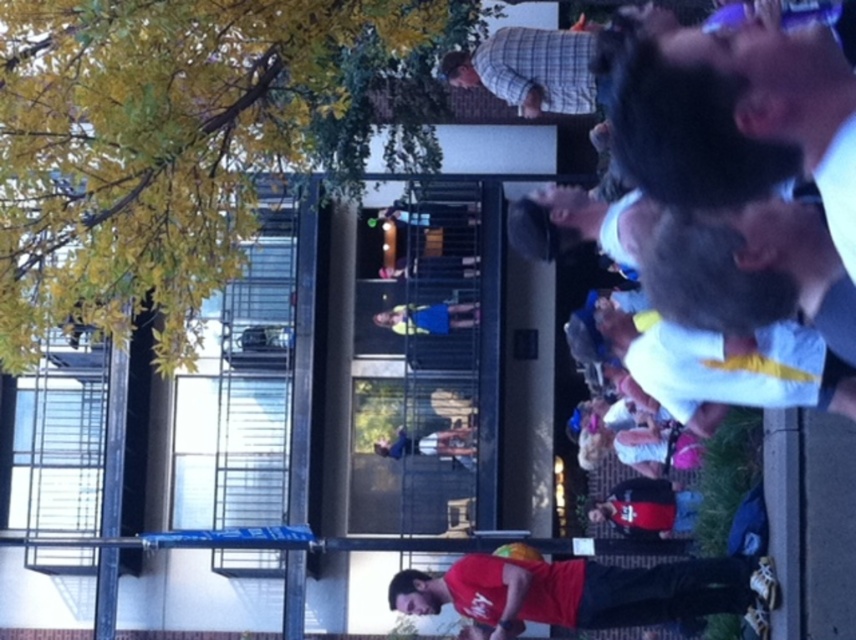
Question: Can you confirm if yellow leafy tree at upper left is positioned to the right of blue fabric dress at center?

Choices:
 (A) no
 (B) yes

Answer: (A)

Question: Does white matte shirt at upper right lie in front of blue fabric dress at center?

Choices:
 (A) no
 (B) yes

Answer: (B)

Question: Which of the following is the closest to the observer?

Choices:
 (A) white matte shirt at upper right
 (B) yellow leafy tree at upper left
 (C) blue fabric dress at center
 (D) red matte shirt at lower center

Answer: (A)

Question: Which object is positioned farthest from the red matte shirt at lower center?

Choices:
 (A) white matte shirt at upper right
 (B) yellow leafy tree at upper left
 (C) blue fabric dress at center

Answer: (C)

Question: Can you confirm if white matte shirt at upper right is positioned above blue fabric dress at center?

Choices:
 (A) no
 (B) yes

Answer: (B)

Question: Estimate the real-world distances between objects in this image. Which object is farther from the blue fabric dress at center?

Choices:
 (A) red matte shirt at lower center
 (B) yellow leafy tree at upper left
 (C) white matte shirt at upper right

Answer: (C)